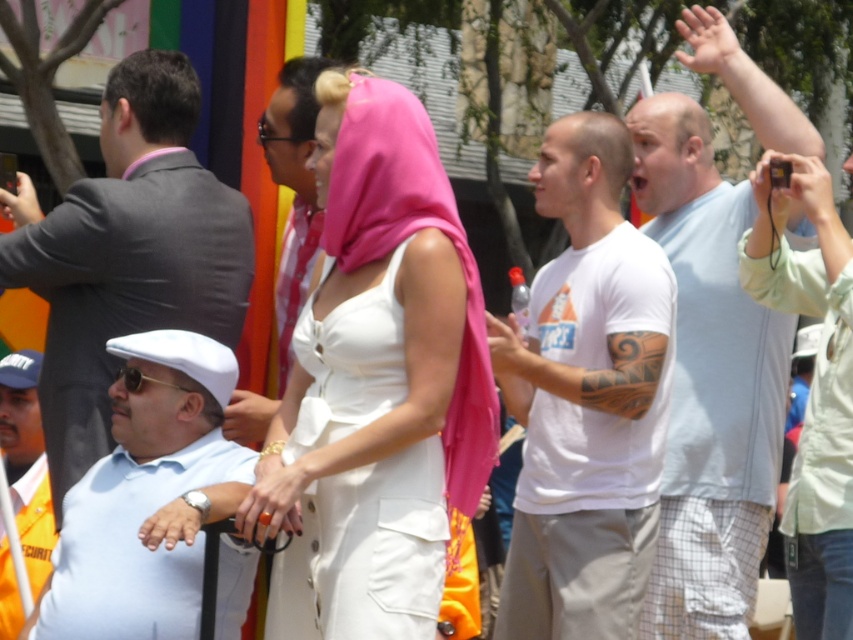
You are a photographer trying to capture the scene with a camera that has a zoom lens. The camera can focus on objects within a 0.2 radius from a chosen point. To ensure the white cotton dress at center is in focus, which point should you aim the camera at?

The white cotton dress at center is located at point (366, 552), so you should aim the camera at that point to ensure it is within the 0.2 radius focus area.